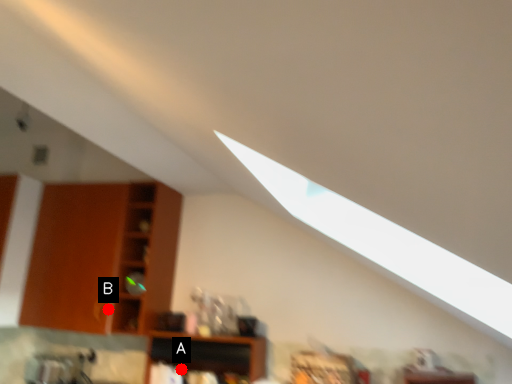
Question: Two points are circled on the image, labeled by A and B beside each circle. Among these points, which one is farthest from the camera?

Choices:
 (A) A is further
 (B) B is further

Answer: (A)